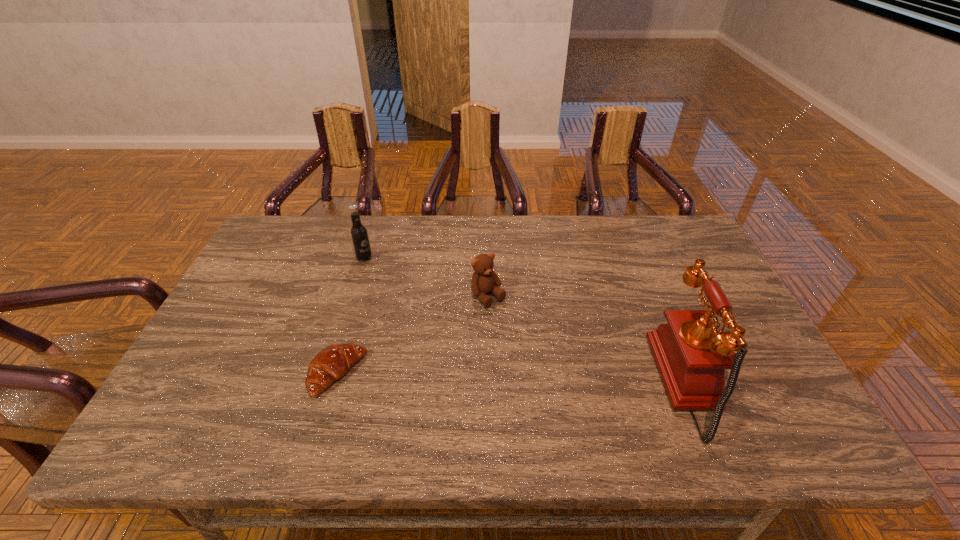
At what (x,y) coordinates should I click in order to perform the action: click on free spot on the desktop that is between the shortest object and the tallest object and is positioned on the face of the third nearest object. Please return your answer as a coordinate pair (x, y). Looking at the image, I should click on (565, 381).

Where is `free space on the desktop that is between the crescent roll and the rightmost object and is positioned on the label of the third shortest object`? free space on the desktop that is between the crescent roll and the rightmost object and is positioned on the label of the third shortest object is located at coordinates (551, 380).